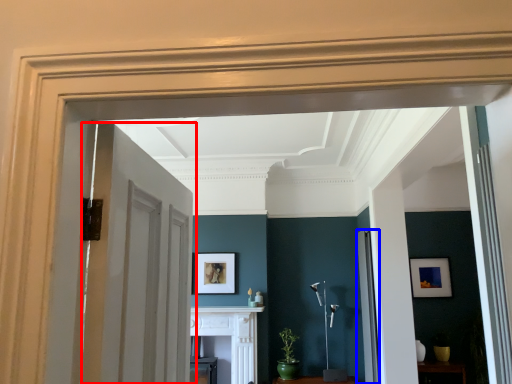
Question: Which of the following is the closest to the observer, door (highlighted by a red box) or door (highlighted by a blue box)?

Choices:
 (A) door
 (B) door

Answer: (A)